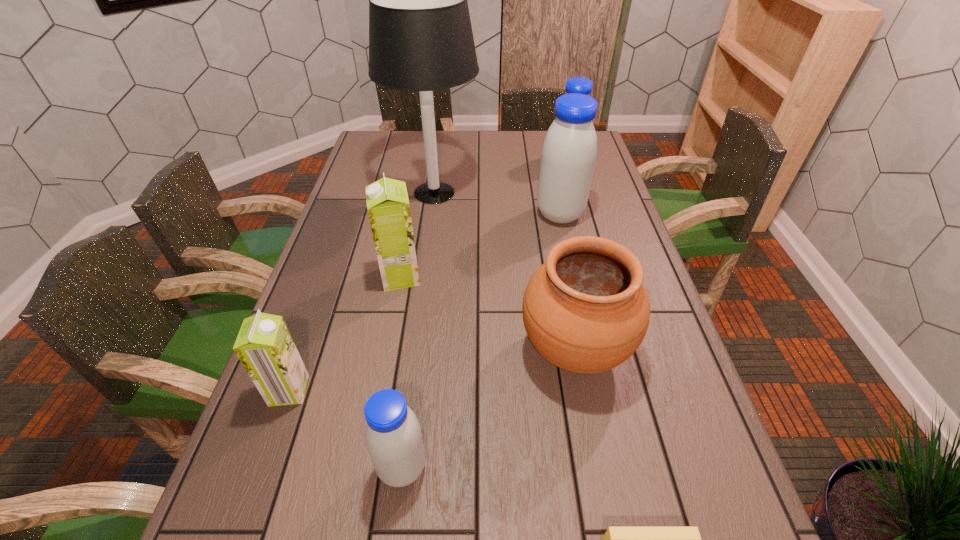
Identify the location of free location that satisfies the following two spatial constraints: 1. on the back side of the second nearest object; 2. on the right side of the farthest soya milk. The width and height of the screenshot is (960, 540). (441, 162).